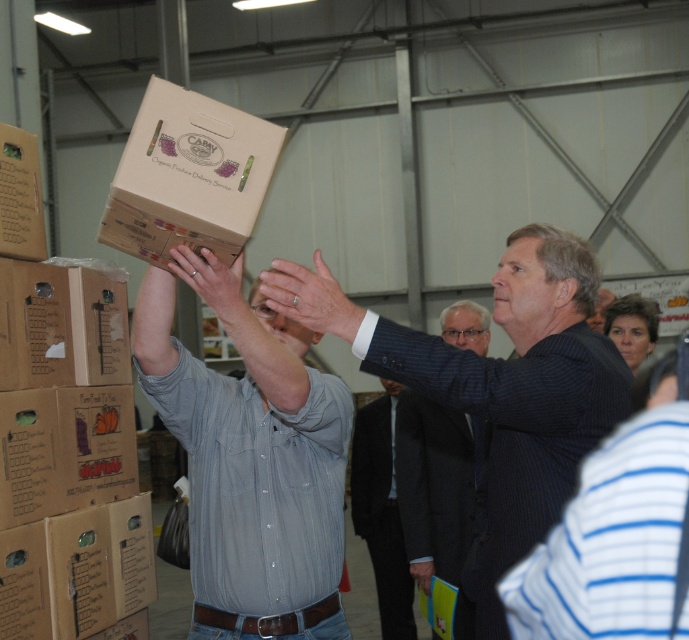
Question: Can you confirm if dark blue suit at center is positioned above matte brown cardboard box at upper left?

Choices:
 (A) no
 (B) yes

Answer: (A)

Question: Considering the real-world distances, which object is closest to the dark blue suit at upper right?

Choices:
 (A) brown cardboard box at upper center
 (B) cardboard box at upper center
 (C) denim shirt at upper center
 (D) dark blue suit at center

Answer: (C)

Question: Which point is farther to the camera?

Choices:
 (A) (123, 285)
 (B) (371, 416)
 (C) (23, 236)

Answer: (B)

Question: Which point is closer to the camera taking this photo?

Choices:
 (A) (588, 362)
 (B) (185, 356)
 (C) (14, 196)
 (D) (220, 104)

Answer: (A)

Question: Is brown cardboard box at upper center wider than matte brown cardboard box at upper left?

Choices:
 (A) no
 (B) yes

Answer: (B)

Question: Does brown cardboard box at upper center have a greater width compared to dark suit at center?

Choices:
 (A) yes
 (B) no

Answer: (A)